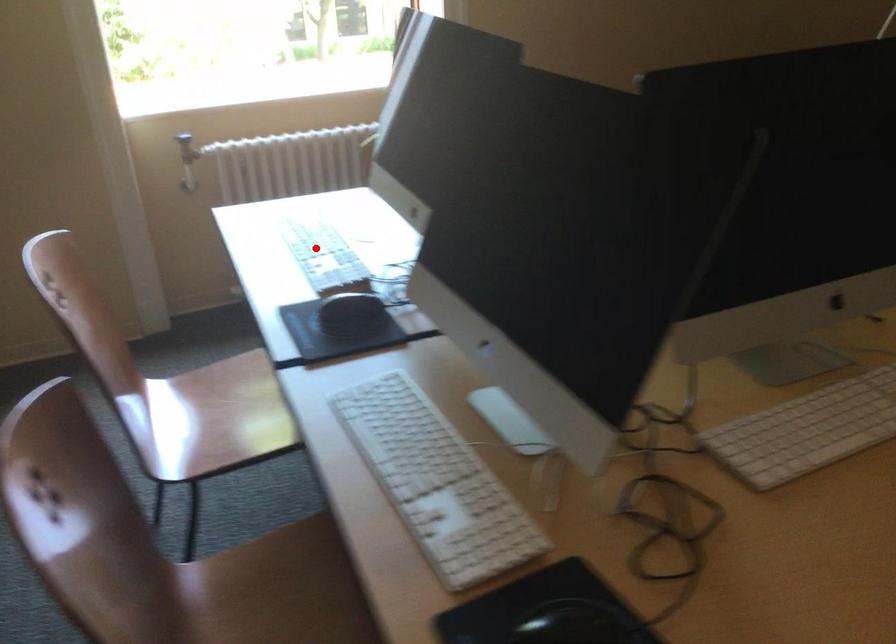
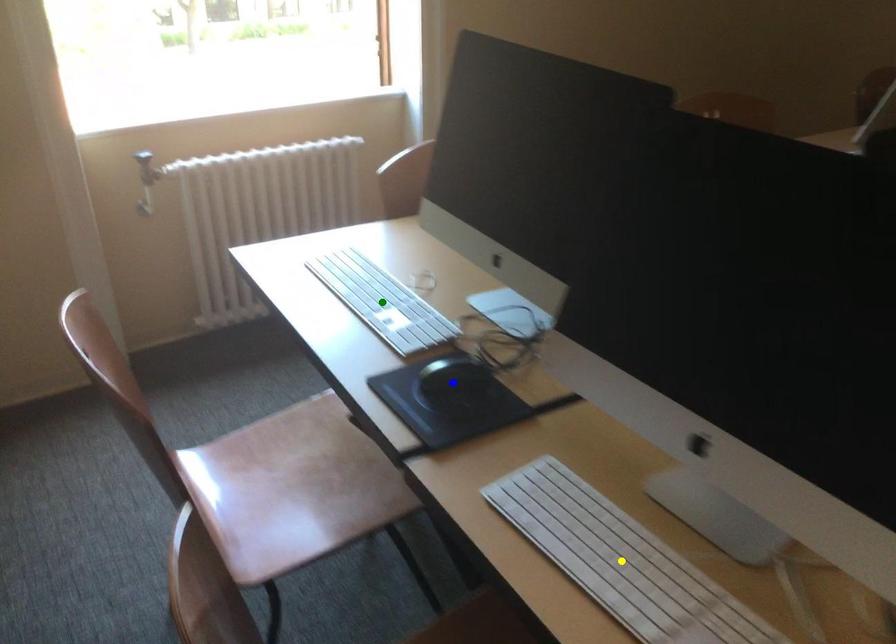
Question: I am providing you with two images of the same scene from different viewpoints. A red point is marked on the first image. You are given multiple points on the second image. Can you choose the point in image 2 that corresponds to the point in image 1?

Choices:
 (A) green point
 (B) yellow point
 (C) blue point

Answer: (A)